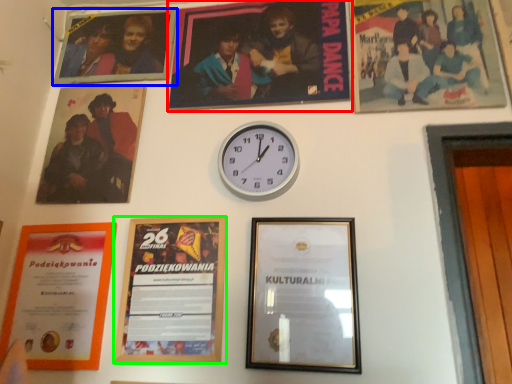
Question: Considering the real-world distances, which object is farthest from picture frame (highlighted by a red box)? picture frame (highlighted by a blue box) or picture frame (highlighted by a green box)?

Choices:
 (A) picture frame
 (B) picture frame

Answer: (B)